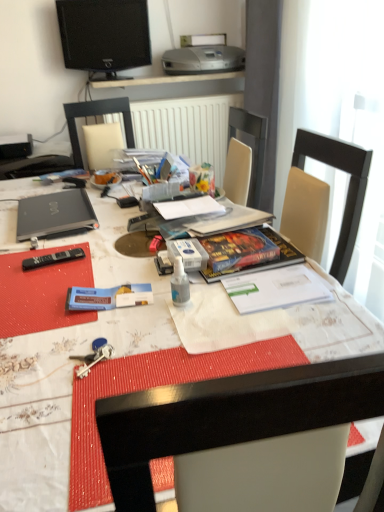
This screenshot has height=512, width=384. In order to click on vacant space to the left of white paper at center in this screenshot , I will do `click(134, 232)`.